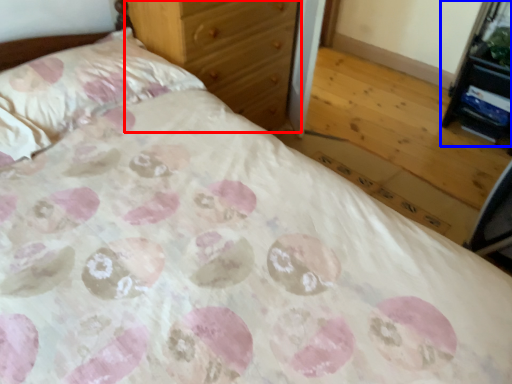
Question: Which object appears closest to the camera in this image, chest of drawers (highlighted by a red box) or vanity (highlighted by a blue box)?

Choices:
 (A) chest of drawers
 (B) vanity

Answer: (A)